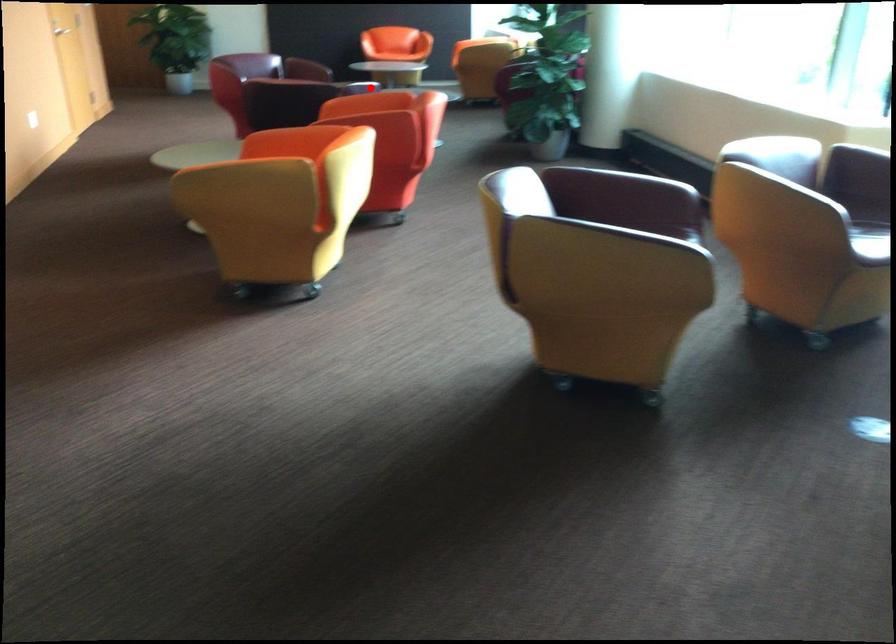
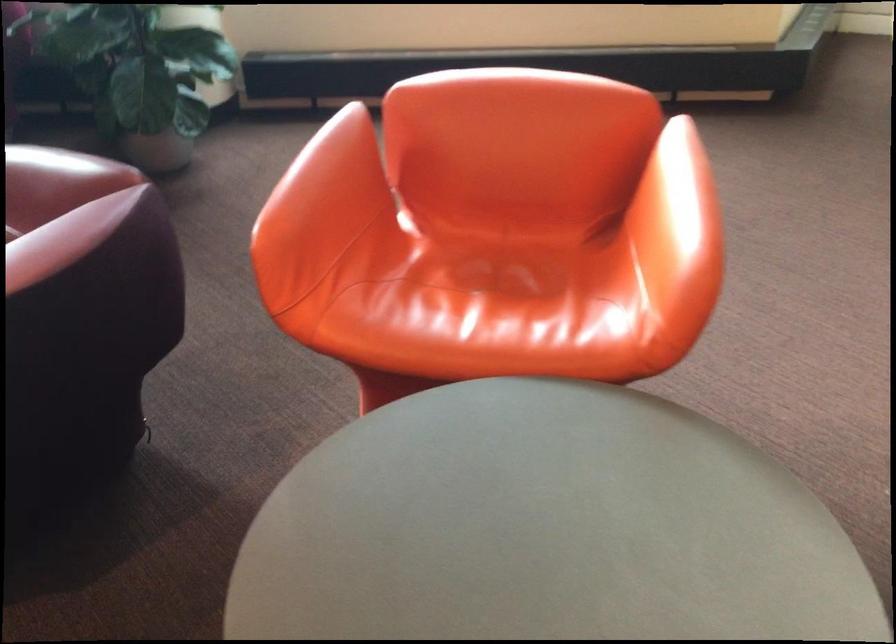
Question: I am providing you with two images of the same scene from different viewpoints. In image1, a red point is highlighted. Considering the same 3D point in image2, which of the following is correct?

Choices:
 (A) It is closer
 (B) It is farther

Answer: (A)